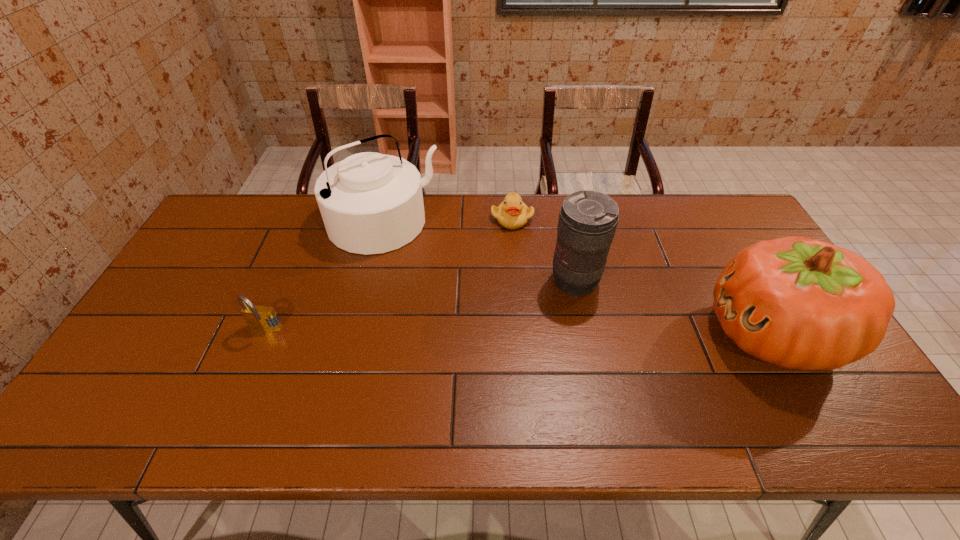
Locate an element on the screen. padlock is located at coordinates (257, 317).

The width and height of the screenshot is (960, 540). I want to click on the fourth tallest object, so click(257, 317).

Find the location of a particular element. the rightmost object is located at coordinates (799, 303).

Find the location of a particular element. The width and height of the screenshot is (960, 540). the second object from right to left is located at coordinates (587, 222).

Image resolution: width=960 pixels, height=540 pixels. Find the location of `the fourth object from right to left`. the fourth object from right to left is located at coordinates (371, 203).

Where is `duckling`? The height and width of the screenshot is (540, 960). duckling is located at coordinates (512, 213).

Where is `the third object from left to right`? the third object from left to right is located at coordinates (512, 213).

The image size is (960, 540). What are the coordinates of `blank space located on the side with the combination dials of the padlock` in the screenshot? It's located at (253, 357).

You are a GUI agent. You are given a task and a screenshot of the screen. Output one action in this format:
    pyautogui.click(x=<x>, y=<y>)
    Task: Click on the vacant space situated on the side of the rightmost object with the cute face
    
    Given the screenshot: What is the action you would take?
    pyautogui.click(x=561, y=334)

Locate an element on the screen. This screenshot has width=960, height=540. vacant space situated 0.340m on the side of the rightmost object with the cute face is located at coordinates [x=579, y=334].